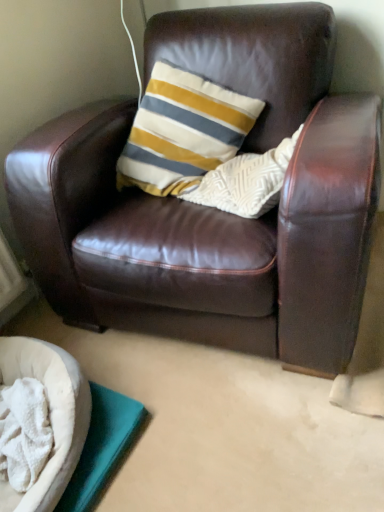
The image size is (384, 512). Identify the location of brown leather chair at center. (214, 209).

Describe the element at coordinates (214, 209) in the screenshot. This screenshot has height=512, width=384. I see `brown leather chair at center` at that location.

Measure the distance between point (260, 337) and camera.

Point (260, 337) is 4.17 feet away from camera.

Describe the element at coordinates (49, 415) in the screenshot. I see `white soft dog bed at lower left` at that location.

Measure the distance between point (29,338) and camera.

Point (29,338) and camera are 1.44 meters apart from each other.

Where is `white soft dog bed at lower left`? The image size is (384, 512). white soft dog bed at lower left is located at coordinates (49, 415).

At what (x,y) coordinates should I click in order to perform the action: click on brown leather chair at center. Please return your answer as a coordinate pair (x, y). Image resolution: width=384 pixels, height=512 pixels. Looking at the image, I should click on (214, 209).

Which object is positioned more to the left, brown leather chair at center or white soft dog bed at lower left?

white soft dog bed at lower left.

Considering the positions of objects brown leather chair at center and white soft dog bed at lower left in the image provided, who is behind, brown leather chair at center or white soft dog bed at lower left?

white soft dog bed at lower left is further from the camera.

Considering the positions of point (110, 248) and point (55, 421), is point (110, 248) closer or farther from the camera than point (55, 421)?

Point (110, 248) appears to be farther away from the viewer than point (55, 421).

Looking at this image, from the image's perspective, would you say brown leather chair at center is shown under white soft dog bed at lower left?

Actually, brown leather chair at center appears above white soft dog bed at lower left in the image.

From a real-world perspective, relative to white soft dog bed at lower left, is brown leather chair at center vertically above or below?

In terms of real-world spatial position, brown leather chair at center is above white soft dog bed at lower left.

Which of these two, brown leather chair at center or white soft dog bed at lower left, is wider?

With larger width is brown leather chair at center.

Is brown leather chair at center taller than white soft dog bed at lower left?

Indeed, brown leather chair at center has a greater height compared to white soft dog bed at lower left.

Is brown leather chair at center smaller than white soft dog bed at lower left?

Actually, brown leather chair at center might be larger than white soft dog bed at lower left.

From the picture: Is white soft dog bed at lower left located within brown leather chair at center?

No, white soft dog bed at lower left is located outside of brown leather chair at center.

Is brown leather chair at center not close to white soft dog bed at lower left?

No, brown leather chair at center is not far from white soft dog bed at lower left.

Is brown leather chair at center looking in the opposite direction of white soft dog bed at lower left?

No.

Locate an element on the screen. dog bed behind the brown leather chair at center is located at coordinates (49, 415).

Which object is positioned more to the right, white soft dog bed at lower left or brown leather chair at center?

From the viewer's perspective, brown leather chair at center appears more on the right side.

Which is in front, white soft dog bed at lower left or brown leather chair at center?

brown leather chair at center is closer to the camera.

Is point (84, 407) behind point (91, 304)?

No, (84, 407) is in front of (91, 304).

From the image's perspective, which is above, white soft dog bed at lower left or brown leather chair at center?

brown leather chair at center is shown above in the image.

From a real-world perspective, is white soft dog bed at lower left on brown leather chair at center?

No, from a real-world perspective, white soft dog bed at lower left is not above brown leather chair at center.

Does white soft dog bed at lower left have a lesser width compared to brown leather chair at center?

Correct, the width of white soft dog bed at lower left is less than that of brown leather chair at center.

Considering the relative sizes of white soft dog bed at lower left and brown leather chair at center in the image provided, is white soft dog bed at lower left taller than brown leather chair at center?

In fact, white soft dog bed at lower left may be shorter than brown leather chair at center.

Considering the relative sizes of white soft dog bed at lower left and brown leather chair at center in the image provided, is white soft dog bed at lower left bigger than brown leather chair at center?

No, white soft dog bed at lower left is not bigger than brown leather chair at center.

Can brown leather chair at center be found inside white soft dog bed at lower left?

Definitely not — brown leather chair at center is not inside white soft dog bed at lower left.

Are white soft dog bed at lower left and brown leather chair at center far apart?

No, white soft dog bed at lower left is not far away from brown leather chair at center.

Looking at this image, is white soft dog bed at lower left facing away from brown leather chair at center?

That's not correct — white soft dog bed at lower left is not looking away from brown leather chair at center.

Consider the image. How different are the orientations of white soft dog bed at lower left and brown leather chair at center in degrees?

The facing directions of white soft dog bed at lower left and brown leather chair at center are 84.7 degrees apart.

In the image, there is a white soft dog bed at lower left. Where is `chair above it (from the image's perspective)`? chair above it (from the image's perspective) is located at coordinates (214, 209).

You are a GUI agent. You are given a task and a screenshot of the screen. Output one action in this format:
    pyautogui.click(x=<x>, y=<y>)
    Task: Click on the chair on the right of the white soft dog bed at lower left
    The height and width of the screenshot is (512, 384).
    Given the screenshot: What is the action you would take?
    pyautogui.click(x=214, y=209)

Identify the location of dog bed lying on the left of brown leather chair at center. (49, 415).